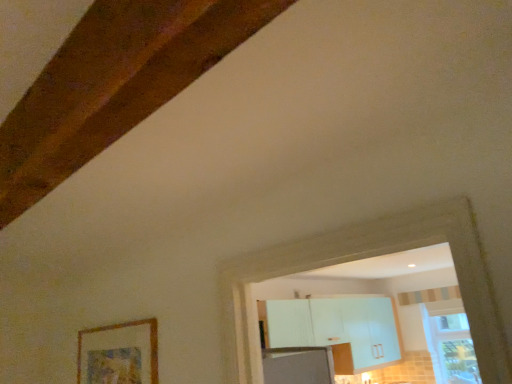
The height and width of the screenshot is (384, 512). What do you see at coordinates (119, 353) in the screenshot?
I see `wooden picture frame at lower left` at bounding box center [119, 353].

Find the location of a particular element. The height and width of the screenshot is (384, 512). wooden picture frame at lower left is located at coordinates (119, 353).

At what (x,y) coordinates should I click in order to perform the action: click on wooden picture frame at lower left. Please return your answer as a coordinate pair (x, y). This screenshot has width=512, height=384. Looking at the image, I should click on (x=119, y=353).